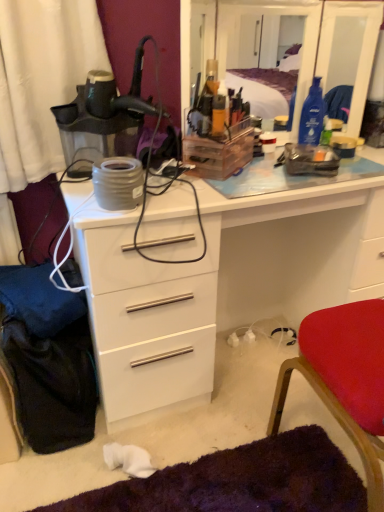
Identify the location of red fabric chair at lower right. The image size is (384, 512). (345, 379).

Locate an element on the screen. This screenshot has height=512, width=384. transparent plastic mirror at upper center is located at coordinates (305, 44).

Is red fabric chair at lower right behind white glossy chest of drawers at center?

No, the depth of red fabric chair at lower right is less than that of white glossy chest of drawers at center.

Does red fabric chair at lower right have a larger size compared to white glossy chest of drawers at center?

Incorrect, red fabric chair at lower right is not larger than white glossy chest of drawers at center.

Is red fabric chair at lower right facing towards white glossy chest of drawers at center?

Yes.

From the image's perspective, is red fabric chair at lower right positioned above or below white glossy chest of drawers at center?

Based on their image positions, red fabric chair at lower right is located beneath white glossy chest of drawers at center.

Is white glossy chest of drawers at center inside or outside of red fabric chair at lower right?

The correct answer is: outside.

Is white glossy chest of drawers at center far from red fabric chair at lower right?

No, white glossy chest of drawers at center is not far from red fabric chair at lower right.

Does point (111, 360) appear closer or farther from the camera than point (377, 443)?

Point (111, 360).

In the scene shown: Is white glossy chest of drawers at center in front of or behind red fabric chair at lower right in the image?

Visually, white glossy chest of drawers at center is located behind red fabric chair at lower right.

Considering the positions of objects transparent plastic mirror at upper center and red fabric chair at lower right in the image provided, who is more to the right, transparent plastic mirror at upper center or red fabric chair at lower right?

red fabric chair at lower right.

Which is in front, point (325, 37) or point (340, 331)?

Point (340, 331)

Is transparent plastic mirror at upper center oriented away from red fabric chair at lower right?

No, transparent plastic mirror at upper center's orientation is not away from red fabric chair at lower right.

Is transparent plastic mirror at upper center not near red fabric chair at lower right?

Yes, transparent plastic mirror at upper center and red fabric chair at lower right are located far from each other.

The image size is (384, 512). I want to click on chest of drawers on the left of the transparent plastic mirror at upper center, so click(220, 284).

How far apart are transparent plastic mirror at upper center and white glossy chest of drawers at center?

transparent plastic mirror at upper center is 9.45 feet away from white glossy chest of drawers at center.

Looking at their sizes, would you say transparent plastic mirror at upper center is wider or thinner than white glossy chest of drawers at center?

transparent plastic mirror at upper center is thinner than white glossy chest of drawers at center.

From a real-world perspective, is transparent plastic mirror at upper center on top of white glossy chest of drawers at center?

Yes, from a real-world perspective, transparent plastic mirror at upper center is on top of white glossy chest of drawers at center.

Does white glossy chest of drawers at center have a greater height compared to transparent plastic mirror at upper center?

Yes, white glossy chest of drawers at center is taller than transparent plastic mirror at upper center.

How much distance is there between white glossy chest of drawers at center and transparent plastic mirror at upper center?

white glossy chest of drawers at center and transparent plastic mirror at upper center are 2.88 meters apart from each other.

Is white glossy chest of drawers at center beside transparent plastic mirror at upper center?

white glossy chest of drawers at center and transparent plastic mirror at upper center are not in contact.

From a real-world perspective, is white glossy chest of drawers at center beneath transparent plastic mirror at upper center?

Correct, in the physical world, white glossy chest of drawers at center is lower than transparent plastic mirror at upper center.

Looking at this image, how different are the orientations of red fabric chair at lower right and transparent plastic mirror at upper center in degrees?

red fabric chair at lower right and transparent plastic mirror at upper center are facing 177 degrees away from each other.

From a real-world perspective, does red fabric chair at lower right stand above transparent plastic mirror at upper center?

No, from a real-world perspective, red fabric chair at lower right is not on top of transparent plastic mirror at upper center.

Between red fabric chair at lower right and transparent plastic mirror at upper center, which one has larger width?

red fabric chair at lower right is wider.

Is red fabric chair at lower right not near transparent plastic mirror at upper center?

Absolutely, red fabric chair at lower right is distant from transparent plastic mirror at upper center.

At what (x,y) coordinates should I click in order to perform the action: click on chair located on the right of white glossy chest of drawers at center. Please return your answer as a coordinate pair (x, y). Looking at the image, I should click on (345, 379).

Locate an element on the screen. chair in front of the white glossy chest of drawers at center is located at coordinates (345, 379).

Based on their spatial positions, is white glossy chest of drawers at center or transparent plastic mirror at upper center closer to red fabric chair at lower right?

white glossy chest of drawers at center.

When comparing their distances from white glossy chest of drawers at center, does red fabric chair at lower right or transparent plastic mirror at upper center seem further?

transparent plastic mirror at upper center.

Based on their spatial positions, is white glossy chest of drawers at center or red fabric chair at lower right closer to transparent plastic mirror at upper center?

white glossy chest of drawers at center lies closer to transparent plastic mirror at upper center than the other object.

Which object lies nearer to the anchor point white glossy chest of drawers at center, transparent plastic mirror at upper center or red fabric chair at lower right?

red fabric chair at lower right is positioned closer to the anchor white glossy chest of drawers at center.

Estimate the real-world distances between objects in this image. Which object is further from red fabric chair at lower right, transparent plastic mirror at upper center or white glossy chest of drawers at center?

Based on the image, transparent plastic mirror at upper center appears to be further to red fabric chair at lower right.

Estimate the real-world distances between objects in this image. Which object is closer to transparent plastic mirror at upper center, red fabric chair at lower right or white glossy chest of drawers at center?

white glossy chest of drawers at center lies closer to transparent plastic mirror at upper center than the other object.

Locate an element on the screen. This screenshot has width=384, height=512. chest of drawers between transparent plastic mirror at upper center and red fabric chair at lower right in the up-down direction is located at coordinates (220, 284).